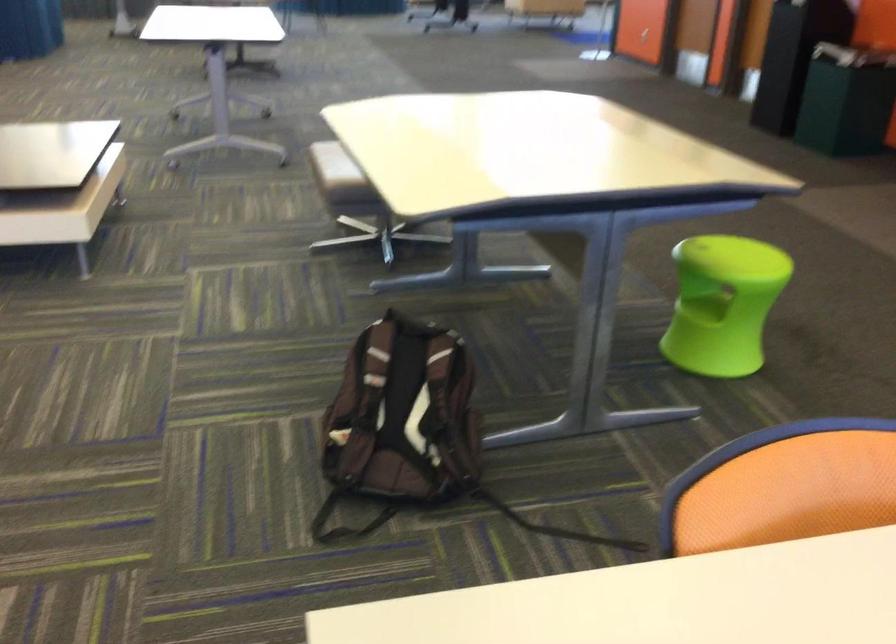
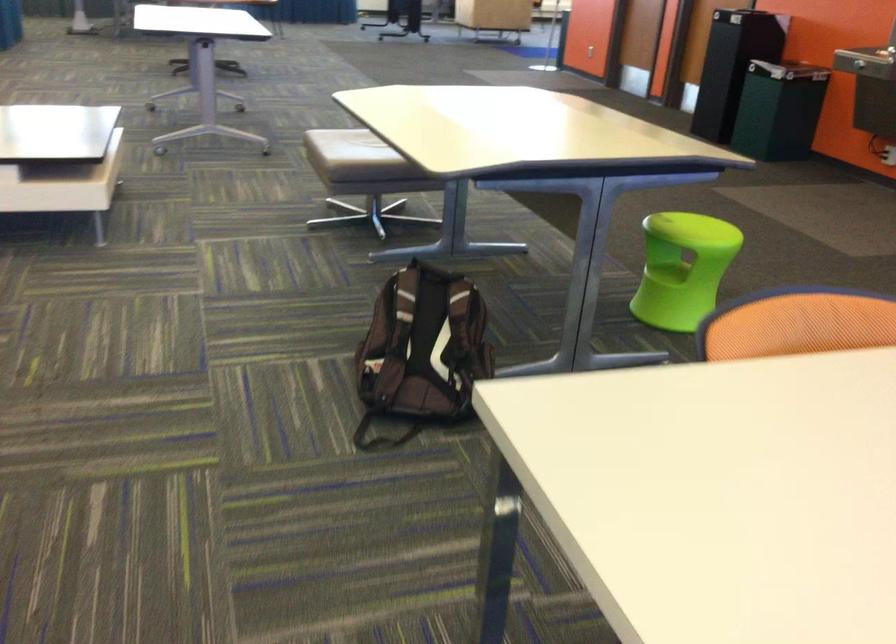
Question: The camera is either moving clockwise (left) or counter-clockwise (right) around the object. The first image is from the beginning of the video and the second image is from the end. Is the camera moving left or right when shooting the video?

Choices:
 (A) Left
 (B) Right

Answer: (A)